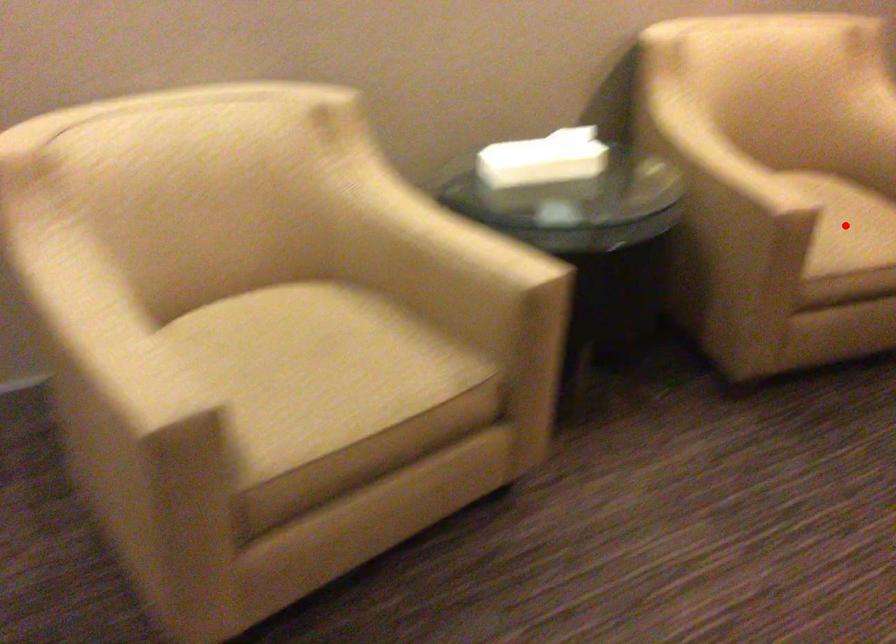
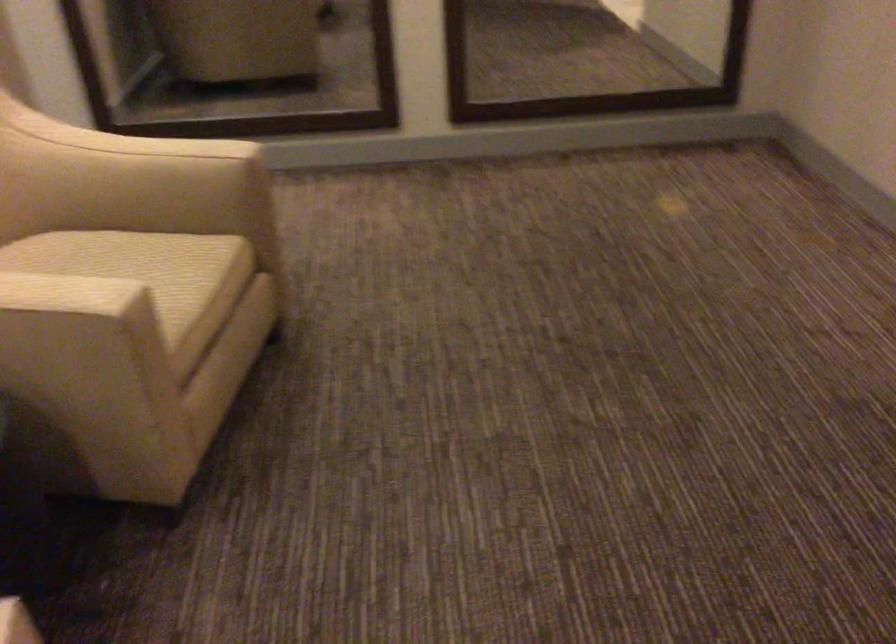
Question: I am providing you with two images of the same scene from different viewpoints. A red point is marked on the first image. At the location where the point appears in image 1, is it still visible in image 2?

Choices:
 (A) Yes
 (B) No

Answer: (B)